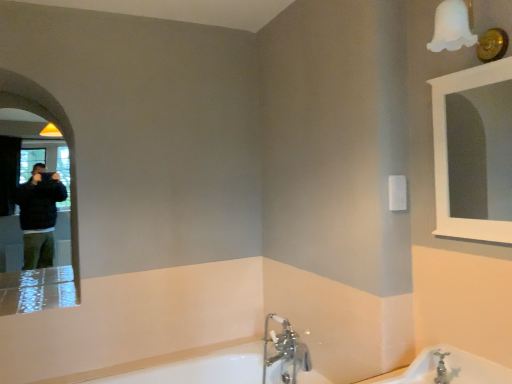
Question: Does white frosted glass light fixture at upper right have a smaller size compared to white glossy bathtub at lower center, placed as the 1th bath when sorted from left to right?

Choices:
 (A) no
 (B) yes

Answer: (B)

Question: Is white frosted glass light fixture at upper right to the left of white glossy bathtub at lower center, which ranks as the first bath in back-to-front order, from the viewer's perspective?

Choices:
 (A) yes
 (B) no

Answer: (B)

Question: Is white frosted glass light fixture at upper right positioned in front of white glossy bathtub at lower center, which ranks as the first bath in back-to-front order?

Choices:
 (A) no
 (B) yes

Answer: (B)

Question: Is white glossy bathtub at lower center, arranged as the 2th bath when viewed from the front, completely or partially inside white frosted glass light fixture at upper right?

Choices:
 (A) no
 (B) yes

Answer: (A)

Question: Considering the relative sizes of white frosted glass light fixture at upper right and white glossy bathtub at lower center, which ranks as the first bath in back-to-front order, in the image provided, is white frosted glass light fixture at upper right shorter than white glossy bathtub at lower center, which ranks as the first bath in back-to-front order,?

Choices:
 (A) no
 (B) yes

Answer: (B)

Question: Does white frosted glass light fixture at upper right have a larger size compared to white glossy bathtub at lower center, which ranks as the first bath in back-to-front order?

Choices:
 (A) no
 (B) yes

Answer: (A)

Question: Is matte black mirror at left, acting as the 2th mirror starting from the right, to the left of white glossy bathtub at lower center, arranged as the 1th bath when ordered from the bottom, from the viewer's perspective?

Choices:
 (A) yes
 (B) no

Answer: (A)

Question: Could you tell me if matte black mirror at left, the first mirror when ordered from left to right, is facing white glossy bathtub at lower center, arranged as the 2th bath when viewed from the front?

Choices:
 (A) no
 (B) yes

Answer: (A)

Question: Considering the relative sizes of matte black mirror at left, the first mirror when ordered from left to right, and white glossy bathtub at lower center, the 2th bath from the top, in the image provided, is matte black mirror at left, the first mirror when ordered from left to right, bigger than white glossy bathtub at lower center, the 2th bath from the top,?

Choices:
 (A) yes
 (B) no

Answer: (B)

Question: Is the depth of matte black mirror at left, the 2th mirror when ordered from front to back, greater than that of white glossy bathtub at lower center, the 2th bath from the top?

Choices:
 (A) no
 (B) yes

Answer: (B)

Question: From a real-world perspective, is matte black mirror at left, the first mirror when ordered from left to right, located beneath white glossy bathtub at lower center, which ranks as the first bath in back-to-front order?

Choices:
 (A) yes
 (B) no

Answer: (B)

Question: Considering the relative sizes of matte black mirror at left, the 2th mirror when ordered from front to back, and white glossy bathtub at lower center, the 2th bath from the top, in the image provided, is matte black mirror at left, the 2th mirror when ordered from front to back, taller than white glossy bathtub at lower center, the 2th bath from the top,?

Choices:
 (A) yes
 (B) no

Answer: (A)

Question: Is white frosted glass light fixture at upper right taller than white porcelain bathtub at lower right, positioned as the 1th bath in front-to-back order?

Choices:
 (A) yes
 (B) no

Answer: (A)